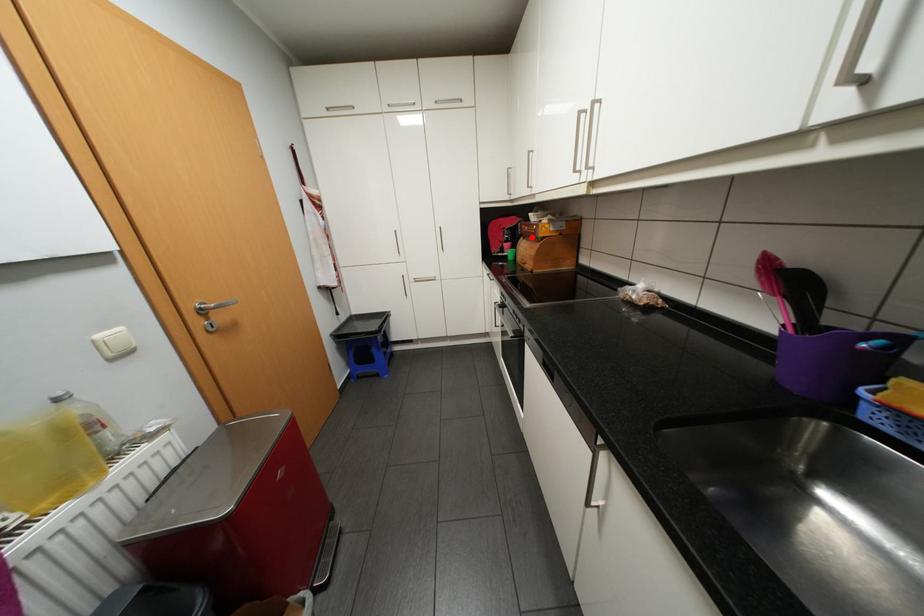
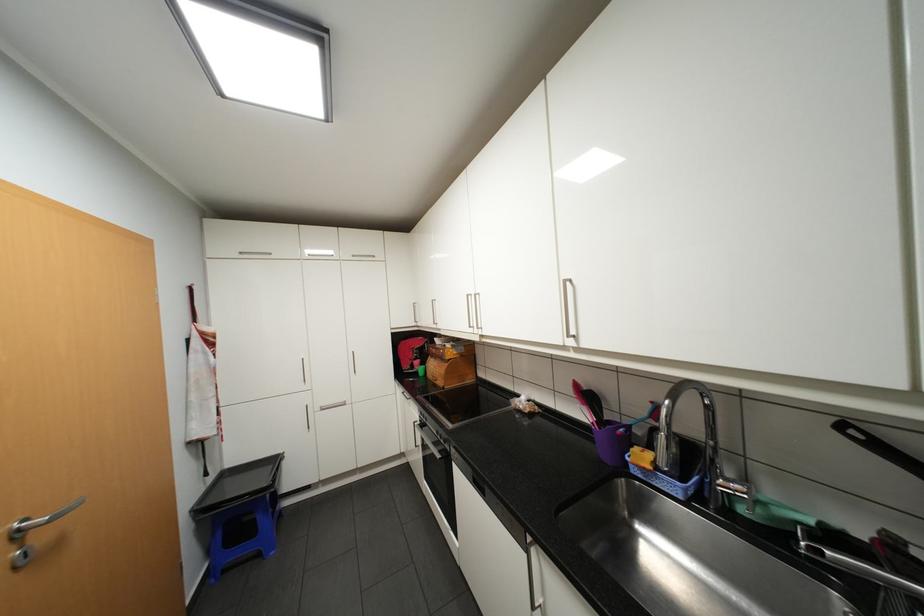
Question: I am providing you with two images of the same scene from different viewpoints. A red point is marked on the first image. Is the red point's position out of view in image 2?

Choices:
 (A) Yes
 (B) No

Answer: (B)